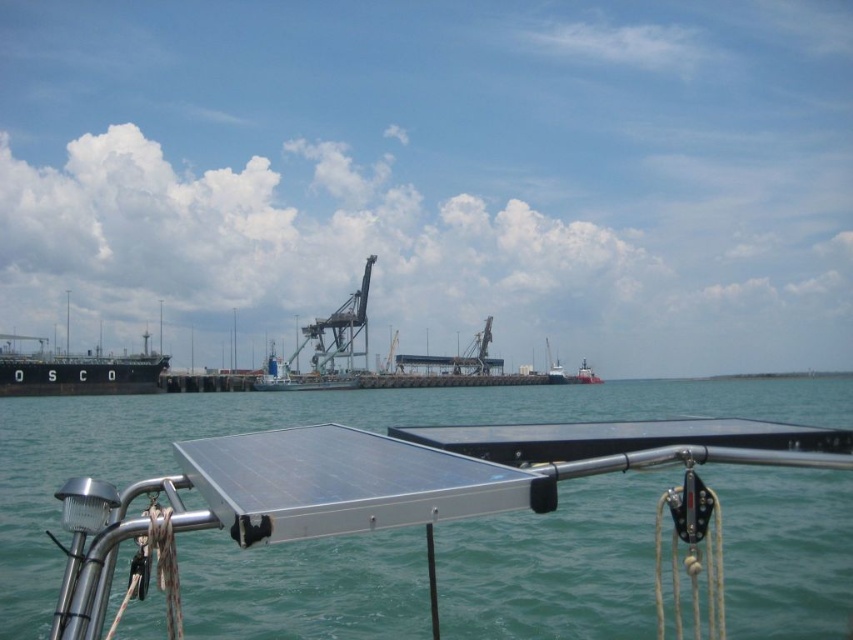
Question: Among these points, which one is nearest to the camera?

Choices:
 (A) (149, 408)
 (B) (88, 394)
 (C) (352, 364)

Answer: (A)

Question: Is metallic blue water at center behind black matte ship at left?

Choices:
 (A) yes
 (B) no

Answer: (B)

Question: Considering the relative positions of metallic blue water at center and metallic gray crane at center in the image provided, where is metallic blue water at center located with respect to metallic gray crane at center?

Choices:
 (A) left
 (B) right

Answer: (B)

Question: Which point appears closest to the camera in this image?

Choices:
 (A) (363, 355)
 (B) (119, 394)
 (C) (421, 396)

Answer: (B)

Question: Which of the following is the closest to the observer?

Choices:
 (A) black matte ship at left
 (B) metallic gray crane at center
 (C) metallic blue water at center

Answer: (C)

Question: Is metallic blue water at center bigger than black matte ship at left?

Choices:
 (A) no
 (B) yes

Answer: (B)